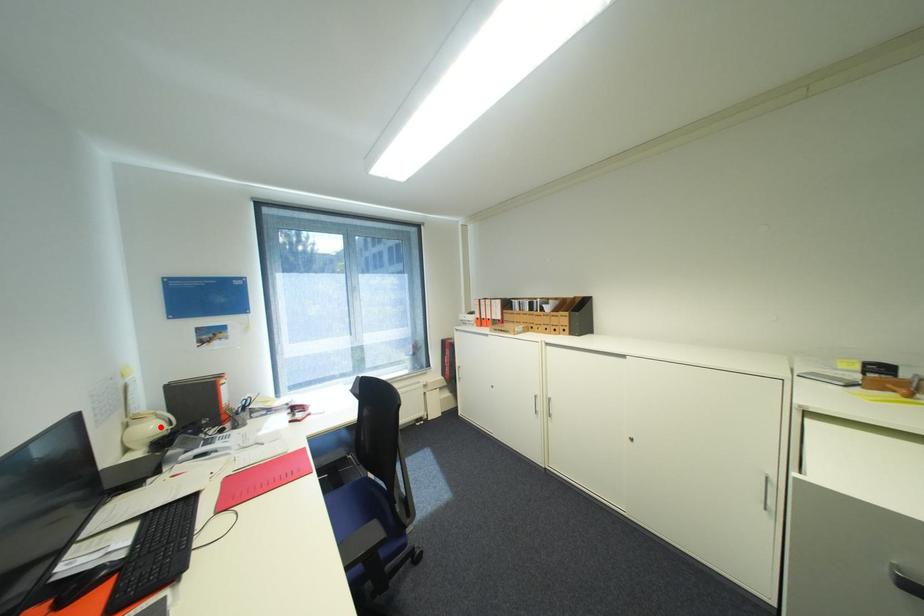
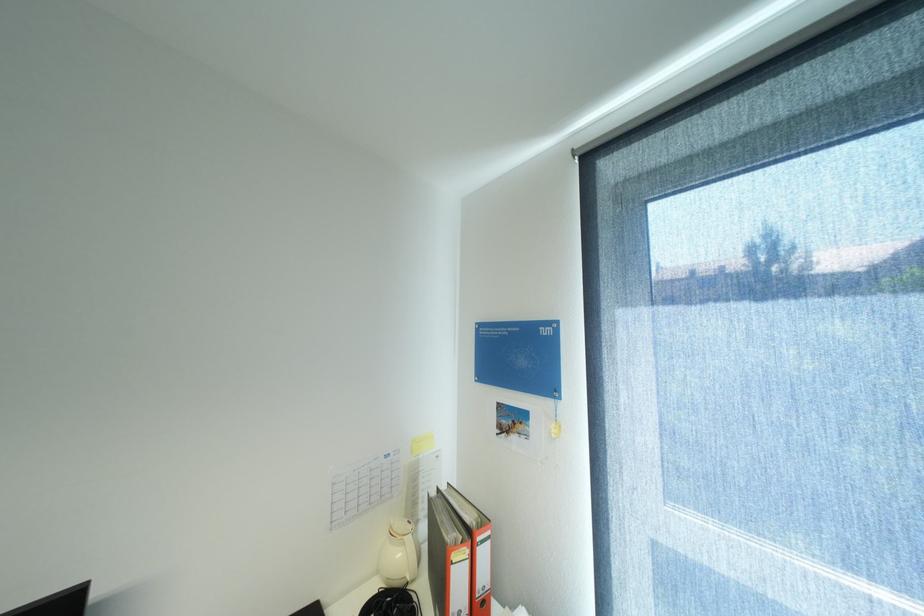
Locate, in the second image, the point that corresponds to the highlighted location in the first image.

(407, 554)